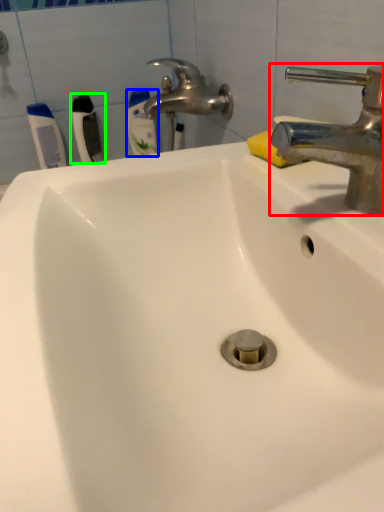
Question: Based on their relative distances, which object is farther from tap (highlighted by a red box)? Choose from toothbrush (highlighted by a blue box) and toothbrush (highlighted by a green box).

Choices:
 (A) toothbrush
 (B) toothbrush

Answer: (A)